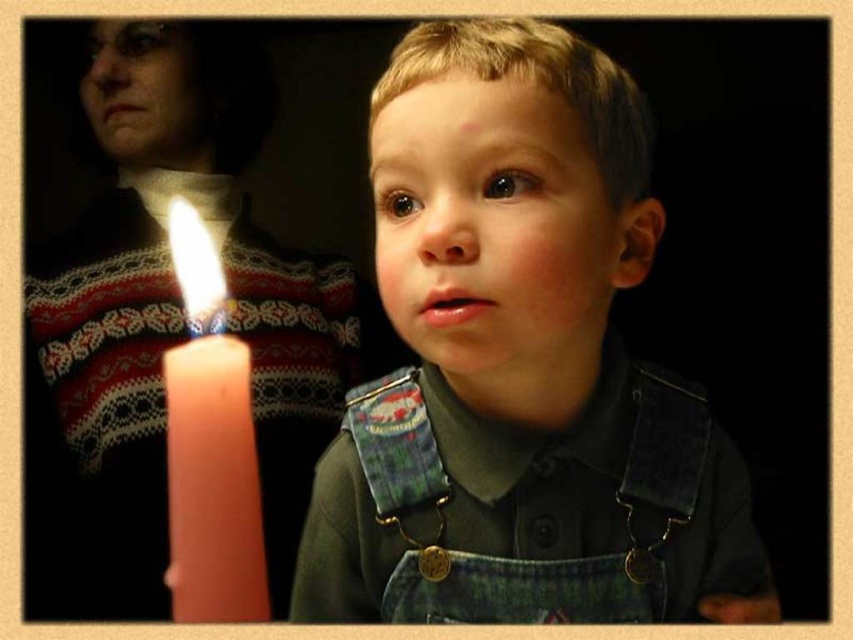
Question: Which point is closer to the camera?

Choices:
 (A) (534, 509)
 (B) (215, 451)

Answer: (B)

Question: Can you confirm if denim overalls at center is smaller than pink wax candle at left?

Choices:
 (A) no
 (B) yes

Answer: (B)

Question: Does denim overalls at center appear under pink wax candle at left?

Choices:
 (A) yes
 (B) no

Answer: (B)

Question: Which point is farther from the camera taking this photo?

Choices:
 (A) (422, 394)
 (B) (169, 381)

Answer: (A)

Question: Is denim overalls at center smaller than pink wax candle at left?

Choices:
 (A) yes
 (B) no

Answer: (A)